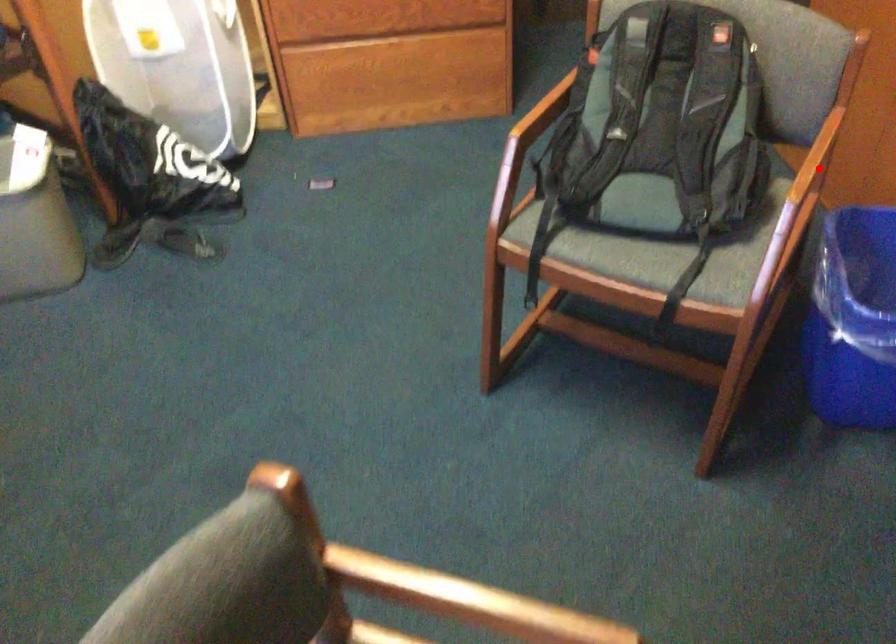
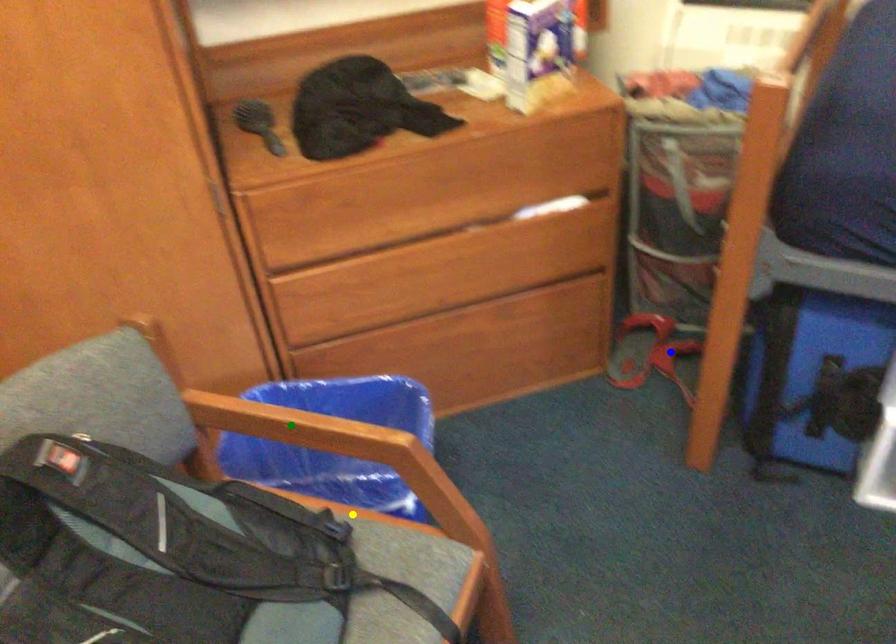
Question: I am providing you with two images of the same scene from different viewpoints. A red point is marked on the first image. You are given multiple points on the second image. Which spot in image 2 lines up with the point in image 1?

Choices:
 (A) blue point
 (B) green point
 (C) yellow point

Answer: (B)